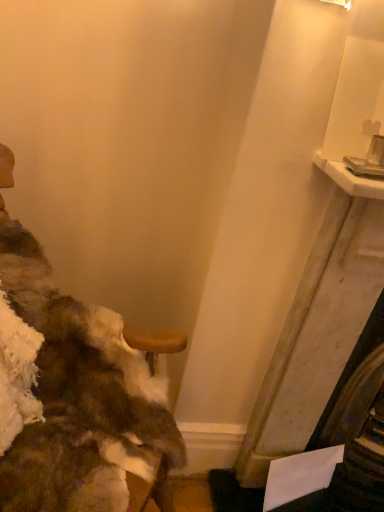
What do you see at coordinates (81, 400) in the screenshot?
I see `brown leather chair at left` at bounding box center [81, 400].

This screenshot has width=384, height=512. Identify the location of brown leather chair at left. (81, 400).

In the scene shown: In order to face brown leather chair at left, should I rotate leftwards or rightwards?

You should look left and rotate roughly 20.844 degrees.

Locate an element on the screen. Image resolution: width=384 pixels, height=512 pixels. brown leather chair at left is located at coordinates (81, 400).